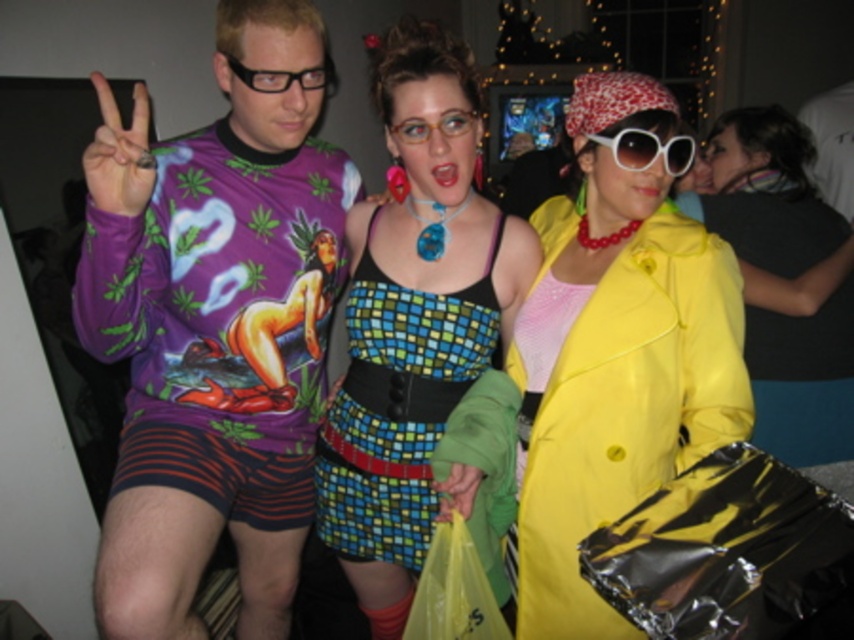
Is purple printed shirt at center shorter than multicolored mosaic dress at center?

No.

Can you confirm if purple printed shirt at center is positioned above multicolored mosaic dress at center?

Actually, purple printed shirt at center is below multicolored mosaic dress at center.

Who is more forward, (230, 396) or (402, 326)?

Point (402, 326) is more forward.

Locate an element on the screen. The image size is (854, 640). purple printed shirt at center is located at coordinates (215, 324).

Can you confirm if purple printed shirt at center is shorter than yellow satin coat at center?

No, purple printed shirt at center is not shorter than yellow satin coat at center.

Which is above, purple printed shirt at center or yellow satin coat at center?

yellow satin coat at center

Based on the photo, who is more forward, (278, 273) or (705, 218)?

Point (278, 273) is more forward.

Where is `purple printed shirt at center`? purple printed shirt at center is located at coordinates (215, 324).

Does yellow satin coat at center come in front of white plastic sunglasses at center?

No, it is behind white plastic sunglasses at center.

Who is more forward, (756, 220) or (619, 150)?

Point (619, 150)

This screenshot has width=854, height=640. Describe the element at coordinates (785, 280) in the screenshot. I see `yellow satin coat at center` at that location.

The width and height of the screenshot is (854, 640). Find the location of `yellow satin coat at center`. yellow satin coat at center is located at coordinates (785, 280).